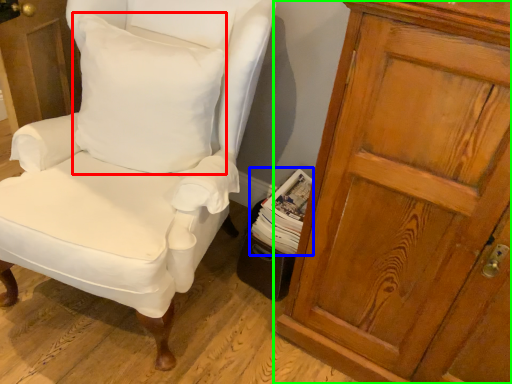
Question: Estimate the real-world distances between objects in this image. Which object is closer to pillow (highlighted by a red box), magazine (highlighted by a blue box) or cupboard (highlighted by a green box)?

Choices:
 (A) magazine
 (B) cupboard

Answer: (A)